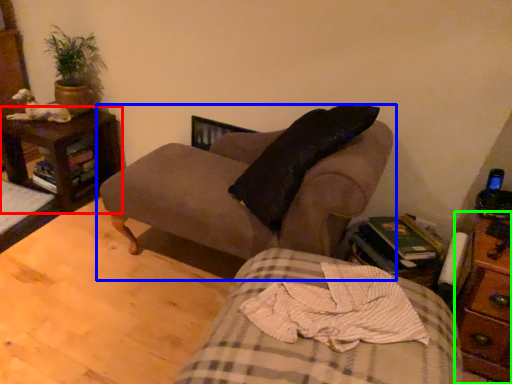
Question: Based on their relative distances, which object is nearer to nightstand (highlighted by a red box)? Choose from studio couch (highlighted by a blue box) and nightstand (highlighted by a green box).

Choices:
 (A) studio couch
 (B) nightstand

Answer: (A)